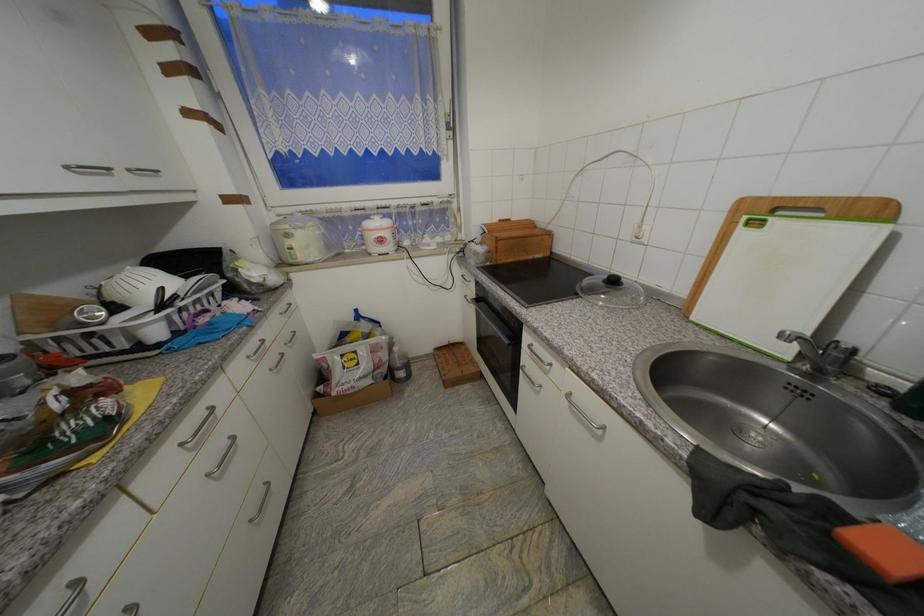
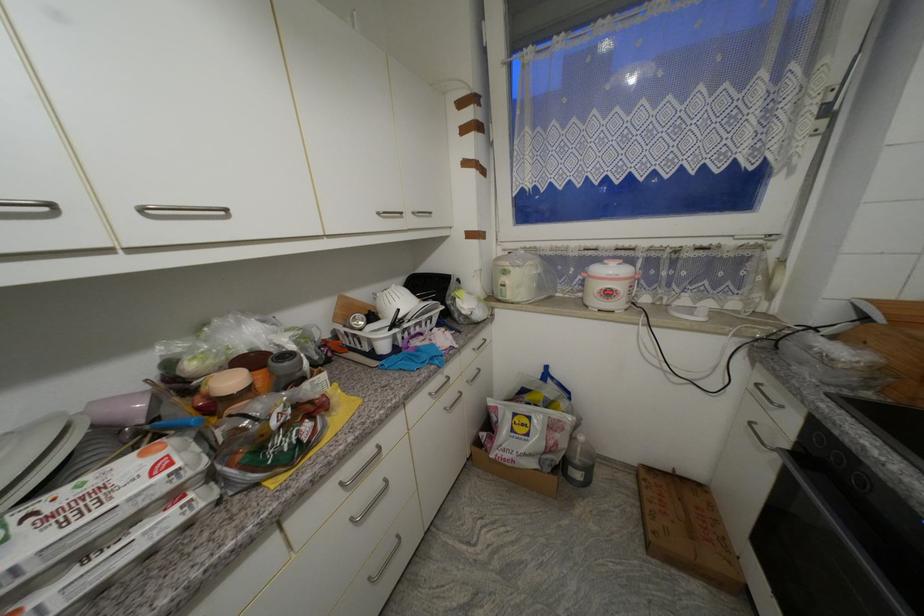
Find the pixel in the second image that matches point (135, 172) in the first image.

(419, 215)